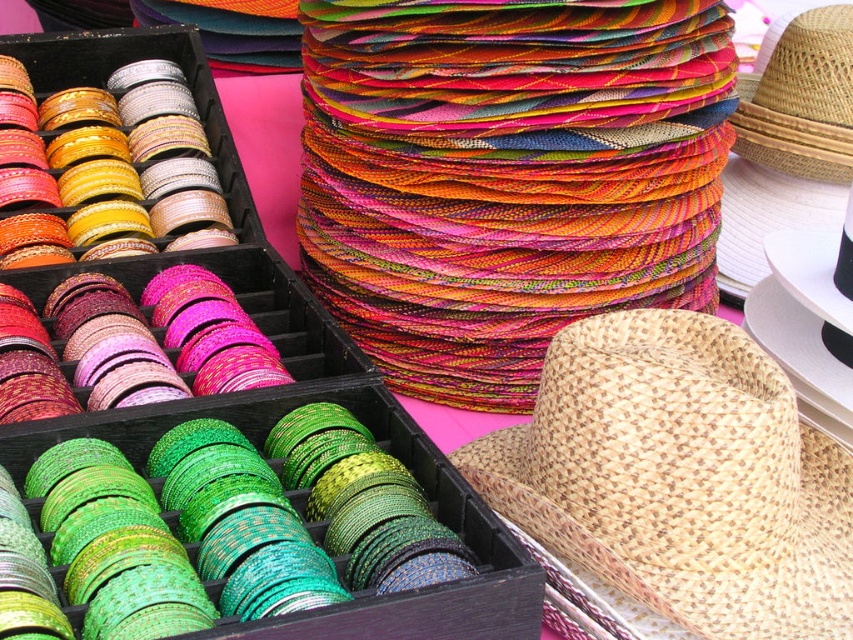
Question: Which point is closer to the camera taking this photo?

Choices:
 (A) (616, 333)
 (B) (782, 65)

Answer: (A)

Question: From the image, what is the correct spatial relationship of natural woven straw hat at lower right in relation to natural straw hat at upper right?

Choices:
 (A) below
 (B) above

Answer: (A)

Question: From the image, what is the correct spatial relationship of natural woven straw hat at lower right in relation to natural straw hat at upper right?

Choices:
 (A) right
 (B) left

Answer: (B)

Question: Can you confirm if natural woven straw hat at lower right is positioned to the right of natural straw hat at upper right?

Choices:
 (A) no
 (B) yes

Answer: (A)